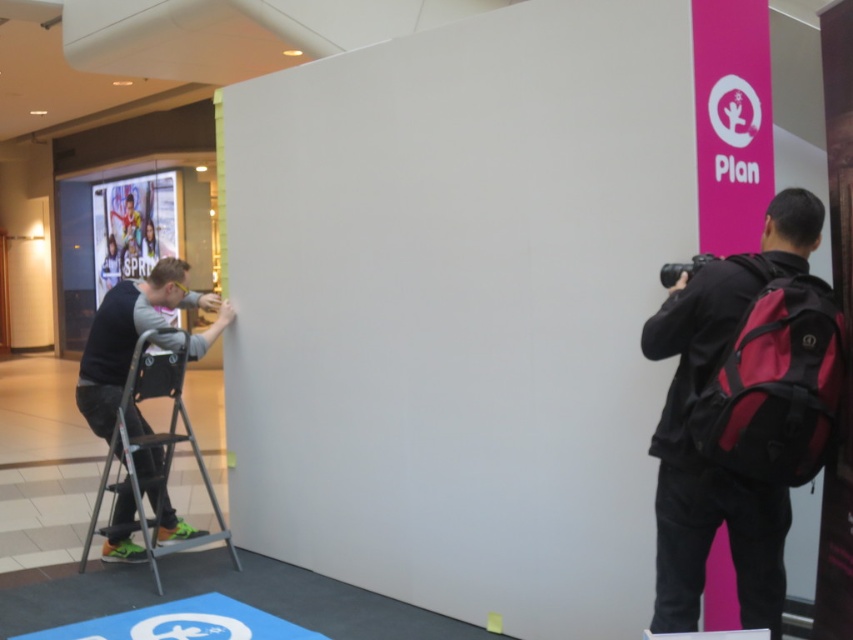
You are organizing an event and need to transport both the black backpack at right and the metallic silver ladder at left. If you have a storage container that can only hold items up to the size of the smaller object, which item will not fit?

The metallic silver ladder at left will not fit in the storage container because the black backpack at right is smaller than metallic silver ladder at left, making the ladder larger than the container capacity.

You are organizing a photography event and need to place a black backpack at right and a metallic silver ladder at left in the scene. Considering their widths, which object should be placed closer to the entrance to ensure both fit within the available space?

The black backpack at right has a lesser width compared to the metallic silver ladder at left, so placing the black backpack closer to the entrance would allow both objects to fit within the available space since it takes up less space.

You are at the event and need to take a photo of the point at coordinates (747, 337). The camera you have is 7.49 feet away from that point. Is the camera close enough to capture the point clearly?

The camera is exactly 7.49 feet away from the point at coordinates (747, 337), so it is close enough to capture the point clearly.